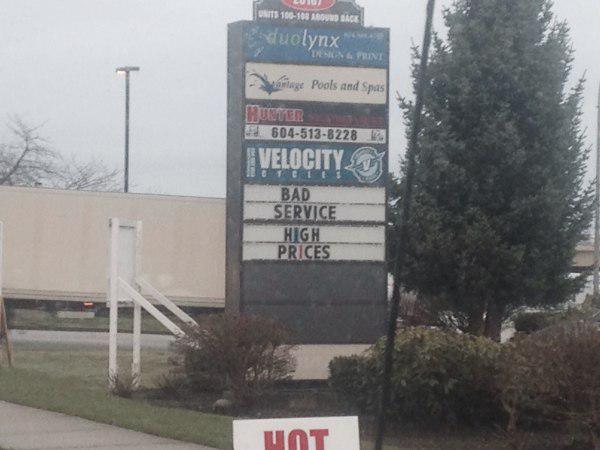
The height and width of the screenshot is (450, 600). Identify the location of white board wood. (133, 298).